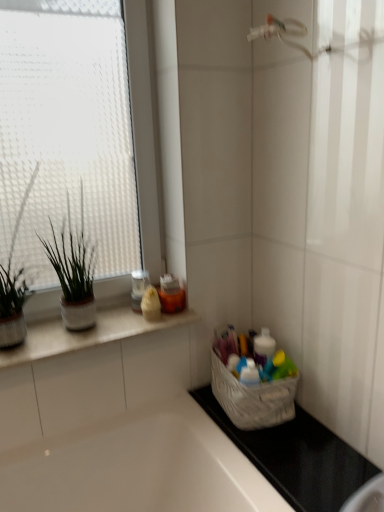
Question: From a real-world perspective, is black rubber mat at lower right below green matte plant at left, which is the second houseplant from right to left?

Choices:
 (A) yes
 (B) no

Answer: (A)

Question: From the image's perspective, is black rubber mat at lower right over green matte plant at left, which is counted as the 1th houseplant, starting from the left?

Choices:
 (A) yes
 (B) no

Answer: (B)

Question: Is black rubber mat at lower right facing towards green matte plant at left, which is counted as the 1th houseplant, starting from the left?

Choices:
 (A) yes
 (B) no

Answer: (B)

Question: Is black rubber mat at lower right shorter than green matte plant at left, which is the second houseplant from right to left?

Choices:
 (A) no
 (B) yes

Answer: (B)

Question: Are black rubber mat at lower right and green matte plant at left, which is the second houseplant from right to left, making contact?

Choices:
 (A) yes
 (B) no

Answer: (B)

Question: Is green matte plant at left, which is counted as the 1th houseplant, starting from the left, at the back of black rubber mat at lower right?

Choices:
 (A) yes
 (B) no

Answer: (B)

Question: Is white fabric basket at lower right closer to camera compared to green matte plant at left, which ranks as the 1th houseplant in right-to-left order?

Choices:
 (A) yes
 (B) no

Answer: (B)

Question: From a real-world perspective, is white fabric basket at lower right beneath green matte plant at left, which ranks as the 1th houseplant in right-to-left order?

Choices:
 (A) no
 (B) yes

Answer: (B)

Question: Can you confirm if white fabric basket at lower right is positioned to the left of green matte plant at left, which is counted as the second houseplant, starting from the left?

Choices:
 (A) no
 (B) yes

Answer: (A)

Question: Are white fabric basket at lower right and green matte plant at left, which is counted as the second houseplant, starting from the left, located far from each other?

Choices:
 (A) yes
 (B) no

Answer: (B)

Question: From the image's perspective, is white fabric basket at lower right over green matte plant at left, which is counted as the second houseplant, starting from the left?

Choices:
 (A) yes
 (B) no

Answer: (B)

Question: Does white fabric basket at lower right touch green matte plant at left, which ranks as the 1th houseplant in right-to-left order?

Choices:
 (A) yes
 (B) no

Answer: (B)

Question: Can you confirm if green matte plant at left, which is the second houseplant from right to left, is bigger than white fabric basket at lower right?

Choices:
 (A) yes
 (B) no

Answer: (A)